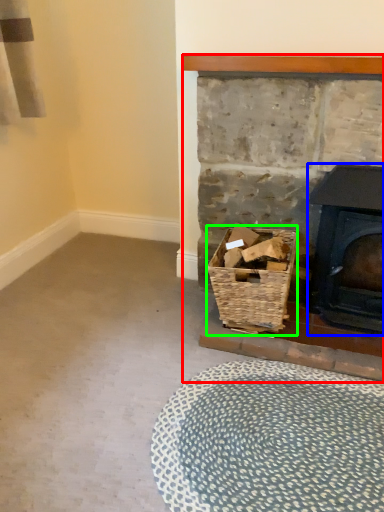
Question: Based on their relative distances, which object is farther from fireplace (highlighted by a red box)? Choose from wood burning stove (highlighted by a blue box) and basket (highlighted by a green box).

Choices:
 (A) wood burning stove
 (B) basket

Answer: (A)